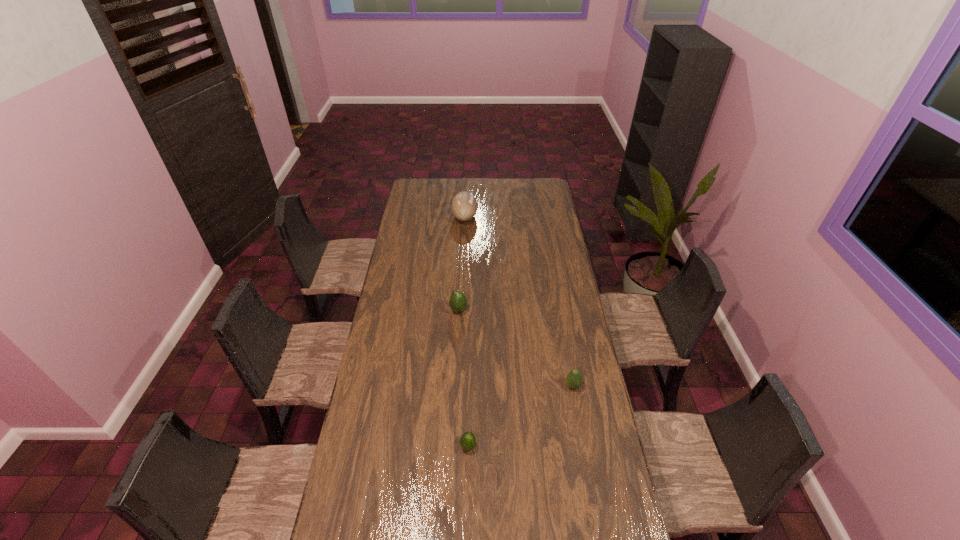
Where is `free spot located 0.260m on the back of the nearest avocado`? free spot located 0.260m on the back of the nearest avocado is located at coordinates (469, 378).

Where is `object that is positioned at the right edge`? object that is positioned at the right edge is located at coordinates click(574, 379).

I want to click on vacant space at the far edge, so click(x=520, y=184).

Locate an element on the screen. This screenshot has width=960, height=540. free space at the left edge is located at coordinates click(x=408, y=218).

The image size is (960, 540). What are the coordinates of `blank area at the right edge` in the screenshot? It's located at (544, 215).

Find the location of `free location at the far right corner of the desktop`. free location at the far right corner of the desktop is located at coordinates (533, 179).

Locate an element on the screen. The height and width of the screenshot is (540, 960). empty space that is in between the second nearest object and the tallest avocado is located at coordinates (516, 348).

Identify the location of vacant area that lies between the second tallest object and the nearest avocado. (464, 379).

The image size is (960, 540). Find the location of `free area in between the second farthest object and the second nearest object`. free area in between the second farthest object and the second nearest object is located at coordinates (516, 348).

Locate an element on the screen. free space between the nearest avocado and the second nearest avocado is located at coordinates (520, 416).